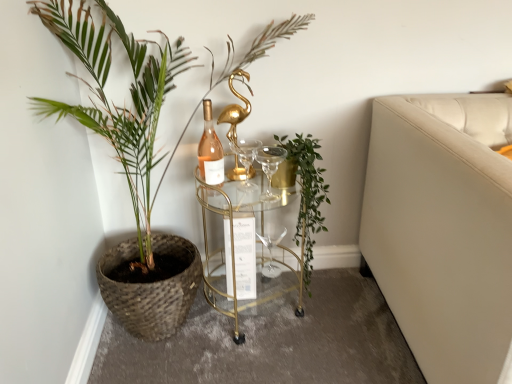
Question: Is matte glass wine bottle at center further to camera compared to transparent glass wine glass at center, which is the first wine glass in bottom-to-top order?

Choices:
 (A) yes
 (B) no

Answer: (B)

Question: Is matte glass wine bottle at center outside of transparent glass wine glass at center, which is the first wine glass in back-to-front order?

Choices:
 (A) no
 (B) yes

Answer: (B)

Question: Is matte glass wine bottle at center turned away from transparent glass wine glass at center, which is the first wine glass in bottom-to-top order?

Choices:
 (A) no
 (B) yes

Answer: (A)

Question: Could you tell me if matte glass wine bottle at center is turned towards transparent glass wine glass at center, which appears as the 2th wine glass when viewed from the front?

Choices:
 (A) no
 (B) yes

Answer: (A)

Question: Is matte glass wine bottle at center shorter than transparent glass wine glass at center, which is the first wine glass in bottom-to-top order?

Choices:
 (A) no
 (B) yes

Answer: (A)

Question: Considering the positions of gold glass table at center and green woven basket at left, the 1th houseplant when ordered from left to right, in the image, is gold glass table at center wider or thinner than green woven basket at left, the 1th houseplant when ordered from left to right,?

Choices:
 (A) thin
 (B) wide

Answer: (A)

Question: Considering the positions of gold glass table at center and green woven basket at left, the 2th houseplant from the right, in the image, is gold glass table at center taller or shorter than green woven basket at left, the 2th houseplant from the right,?

Choices:
 (A) short
 (B) tall

Answer: (A)

Question: From the image's perspective, is gold glass table at center located above or below green woven basket at left, the 2th houseplant from the right?

Choices:
 (A) above
 (B) below

Answer: (B)

Question: Considering the relative positions of gold glass table at center and green woven basket at left, the 2th houseplant from the right, in the image provided, is gold glass table at center to the left or to the right of green woven basket at left, the 2th houseplant from the right,?

Choices:
 (A) left
 (B) right

Answer: (B)

Question: From the image's perspective, relative to gold glass table at center, is matte glass wine bottle at center above or below?

Choices:
 (A) above
 (B) below

Answer: (A)

Question: In terms of width, does matte glass wine bottle at center look wider or thinner when compared to gold glass table at center?

Choices:
 (A) wide
 (B) thin

Answer: (B)

Question: In terms of height, does matte glass wine bottle at center look taller or shorter compared to gold glass table at center?

Choices:
 (A) short
 (B) tall

Answer: (A)

Question: From a real-world perspective, is matte glass wine bottle at center above or below gold glass table at center?

Choices:
 (A) below
 (B) above

Answer: (B)

Question: Considering the positions of green leafy plant at center, which ranks as the first houseplant in right-to-left order, and transparent glass wine glass at center, positioned as the 2th wine glass in top-to-bottom order, in the image, is green leafy plant at center, which ranks as the first houseplant in right-to-left order, taller or shorter than transparent glass wine glass at center, positioned as the 2th wine glass in top-to-bottom order,?

Choices:
 (A) tall
 (B) short

Answer: (A)

Question: In the image, is green leafy plant at center, which ranks as the first houseplant in right-to-left order, positioned in front of or behind transparent glass wine glass at center, which is the first wine glass in back-to-front order?

Choices:
 (A) behind
 (B) front

Answer: (B)